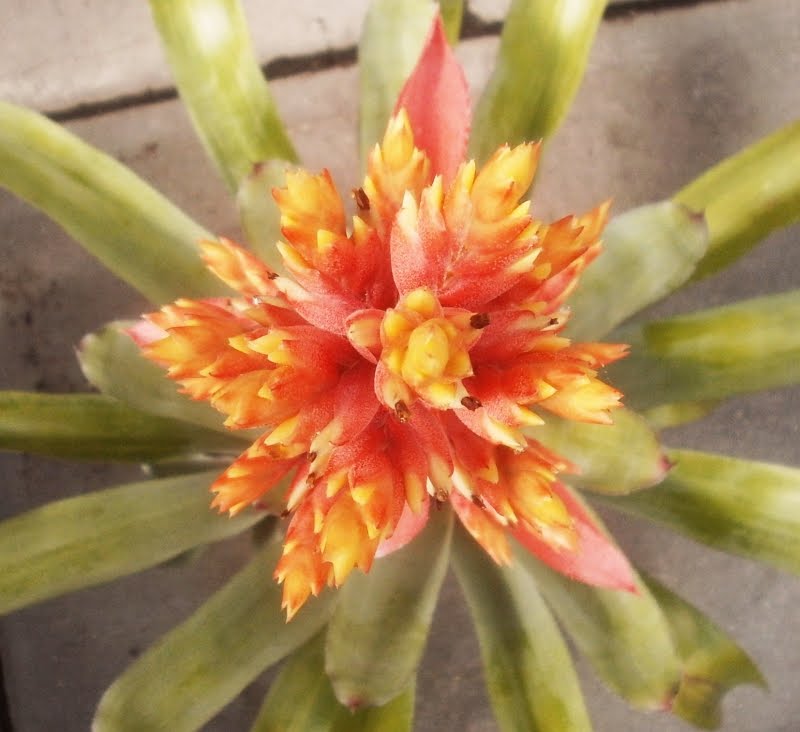
The image size is (800, 732). What are the coordinates of `grout` in the screenshot? It's located at (312, 64), (130, 100), (634, 10), (468, 31).